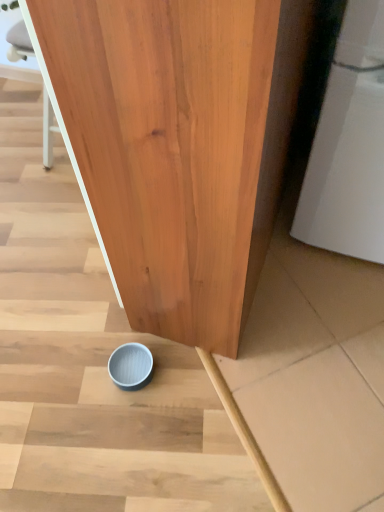
Question: From their relative heights in the image, would you say light blue matte bowl at lower center is taller or shorter than blue matte bowl at lower center?

Choices:
 (A) short
 (B) tall

Answer: (A)

Question: Does point (135, 348) appear closer or farther from the camera than point (54, 189)?

Choices:
 (A) closer
 (B) farther

Answer: (A)

Question: From the image's perspective, is light blue matte bowl at lower center located above or below blue matte bowl at lower center?

Choices:
 (A) below
 (B) above

Answer: (A)

Question: Considering the positions of blue matte bowl at lower center and light blue matte bowl at lower center in the image, is blue matte bowl at lower center wider or thinner than light blue matte bowl at lower center?

Choices:
 (A) thin
 (B) wide

Answer: (B)

Question: Choose the correct answer: Is blue matte bowl at lower center inside light blue matte bowl at lower center or outside it?

Choices:
 (A) outside
 (B) inside

Answer: (A)

Question: Is blue matte bowl at lower center in front of or behind light blue matte bowl at lower center in the image?

Choices:
 (A) front
 (B) behind

Answer: (A)

Question: Considering the positions of point (139, 443) and point (115, 360), is point (139, 443) closer or farther from the camera than point (115, 360)?

Choices:
 (A) farther
 (B) closer

Answer: (B)